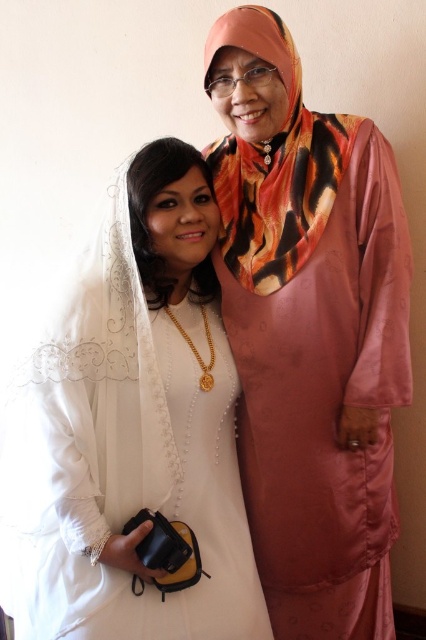
Between point (406, 388) and point (131, 349), which one is positioned behind?

The point (406, 388) is behind.

Does point (238, 17) come farther from viewer compared to point (71, 488)?

Yes.

Which is in front, point (224, 56) or point (43, 612)?

Positioned in front is point (43, 612).

Where is `silky pink dress at right`? This screenshot has width=426, height=640. silky pink dress at right is located at coordinates (310, 336).

Can you confirm if silky pink dress at right is positioned to the right of orange tiger print scarf at upper right?

Indeed, silky pink dress at right is positioned on the right side of orange tiger print scarf at upper right.

Does silky pink dress at right come in front of orange tiger print scarf at upper right?

No, it is not.

Where is `silky pink dress at right`? Image resolution: width=426 pixels, height=640 pixels. silky pink dress at right is located at coordinates (310, 336).

Who is taller, matte white dress at center or orange tiger print scarf at upper right?

With more height is matte white dress at center.

Based on the photo, does matte white dress at center have a lesser width compared to orange tiger print scarf at upper right?

In fact, matte white dress at center might be wider than orange tiger print scarf at upper right.

Which is behind, point (193, 412) or point (229, 189)?

The point (229, 189) is behind.

The width and height of the screenshot is (426, 640). I want to click on matte white dress at center, so click(x=131, y=429).